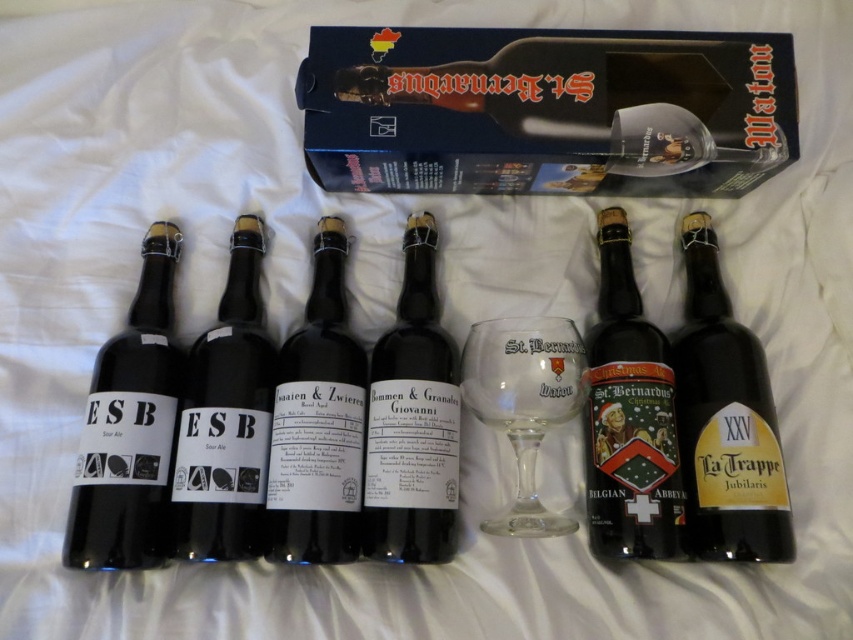
Is point (161, 262) positioned before point (320, 467)?

No, it is behind (320, 467).

Is matte black bottle at left bigger than black matte bottle at center?

Incorrect, matte black bottle at left is not larger than black matte bottle at center.

Who is more distant from viewer, (x=131, y=442) or (x=357, y=464)?

The point (x=357, y=464) is more distant.

Find the location of a particular element. This screenshot has height=640, width=853. matte black bottle at left is located at coordinates (129, 428).

Does dark brown glass bottle at center-right come behind transparent glass wine glass at center?

No, it is not.

Can you confirm if dark brown glass bottle at center-right is shorter than transparent glass wine glass at center?

Result: No, dark brown glass bottle at center-right is not shorter than transparent glass wine glass at center.

Between point (709, 390) and point (538, 364), which one is positioned in front?

Point (709, 390) is more forward.

You are a GUI agent. You are given a task and a screenshot of the screen. Output one action in this format:
    pyautogui.click(x=<x>, y=<y>)
    Task: Click on the dark brown glass bottle at center-right
    
    Given the screenshot: What is the action you would take?
    pyautogui.click(x=724, y=419)

Does blue cardboard box at upper center lie behind black glass bottle at center?

Yes, it is.

Does blue cardboard box at upper center appear under black glass bottle at center?

Incorrect, blue cardboard box at upper center is not positioned below black glass bottle at center.

What are the coordinates of `blue cardboard box at upper center` in the screenshot? It's located at (546, 109).

You are a GUI agent. You are given a task and a screenshot of the screen. Output one action in this format:
    pyautogui.click(x=<x>, y=<y>)
    Task: Click on the blue cardboard box at upper center
    
    Given the screenshot: What is the action you would take?
    pyautogui.click(x=546, y=109)